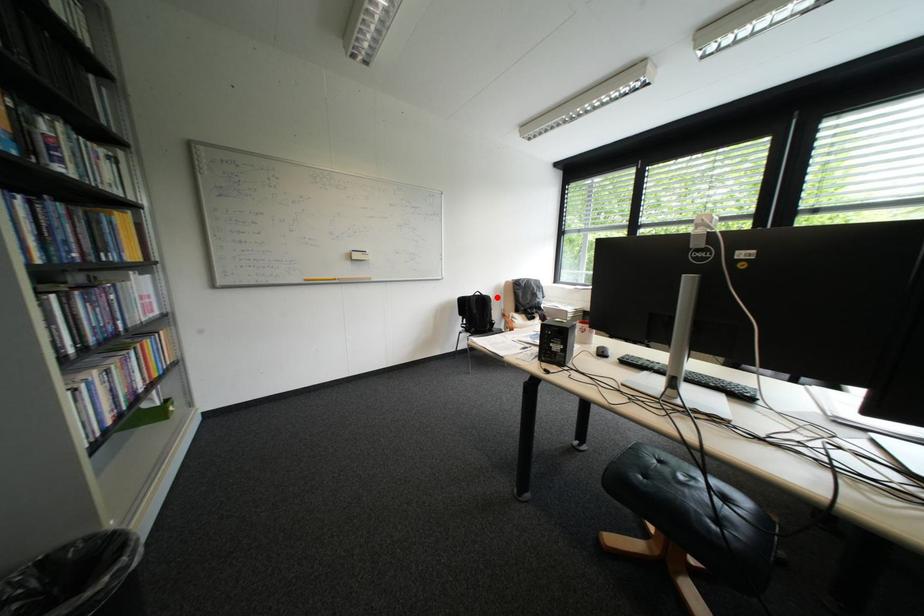
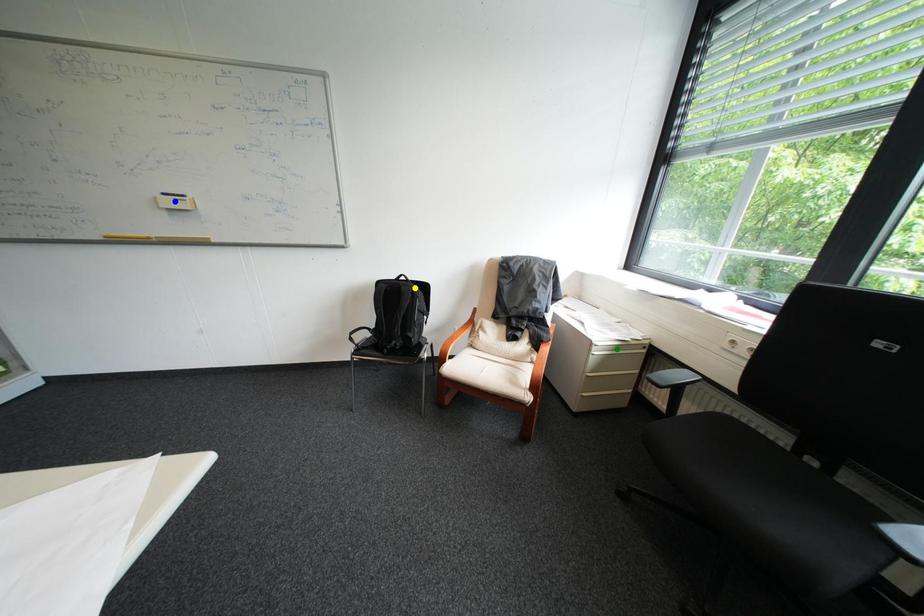
Question: I am providing you with two images of the same scene from different viewpoints. A red point is marked on the first image. You are given multiple points on the second image. Can you choose the point in image 2 that corresponds to the point in image 1?

Choices:
 (A) green point
 (B) yellow point
 (C) blue point

Answer: (B)